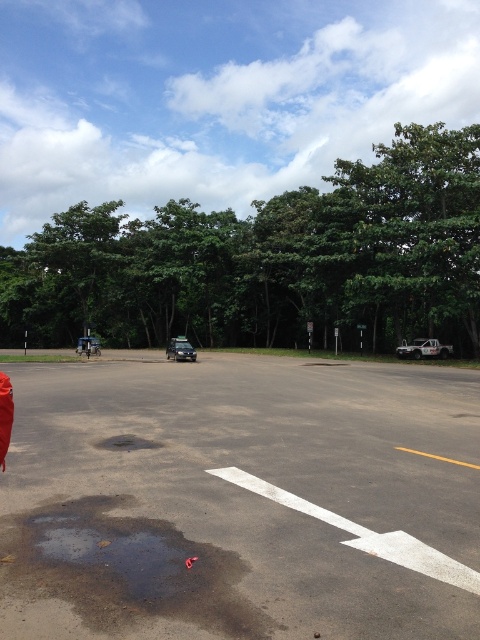
You are a delivery driver who needs to avoid the brown matte puddle at lower center and the metallic blue truck at left while parking. Which direction should you move your vehicle to stay clear of both?

To avoid both the brown matte puddle at lower center and the metallic blue truck at left, you should move your vehicle to the right, as the puddle is located to the right of the truck and moving right would place you away from both obstacles.

You are standing at the center of the paved area and see the brown matte puddle at lower center. According to the coordinates provided, is the puddle closer to the left or right edge of the image?

The brown matte puddle at lower center is located at coordinates point (126, 568). Since the x coordinate is 0.889, which is closer to 1.0, the right edge of the image, the puddle is closer to the right edge.